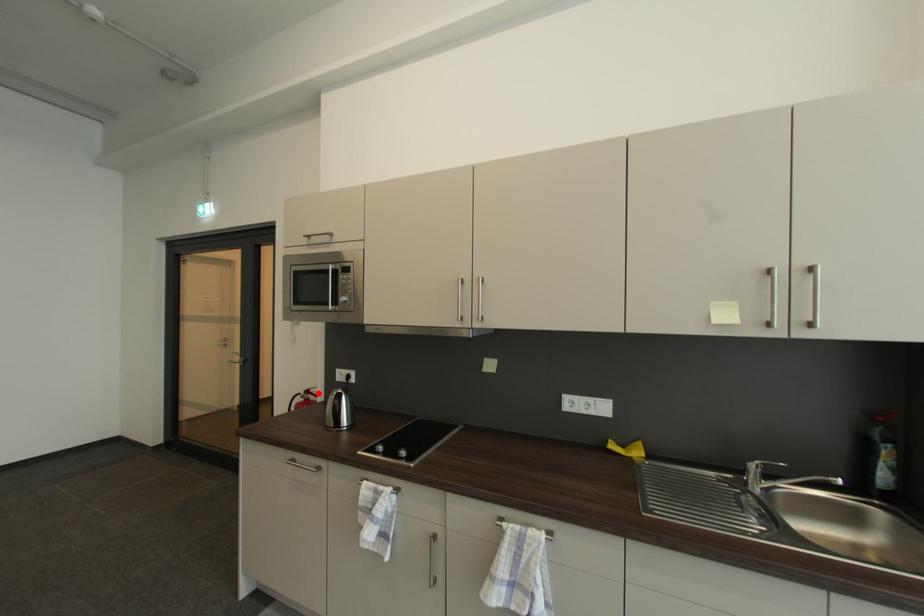
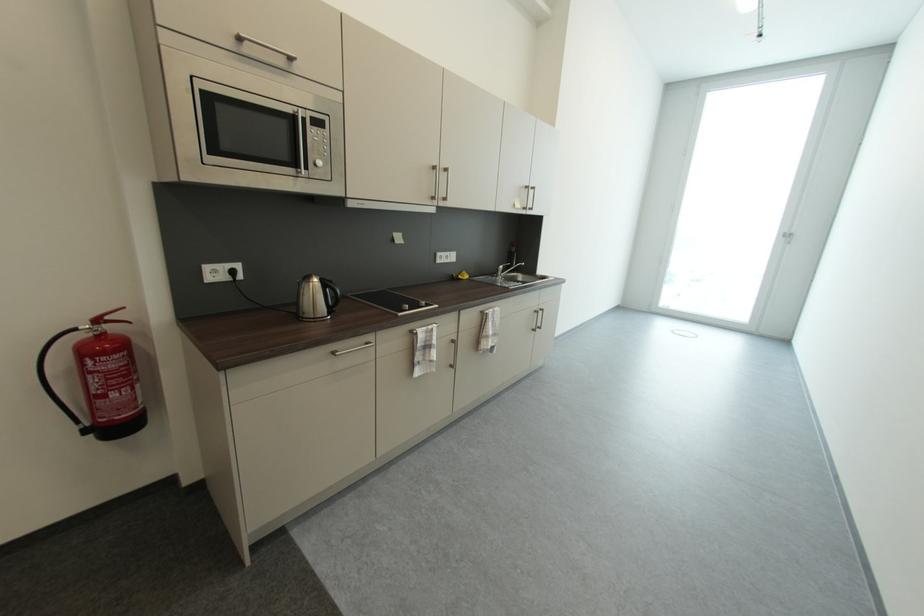
Where in the second image is the point corresponding to the highlighted location from the first image?

(116, 318)